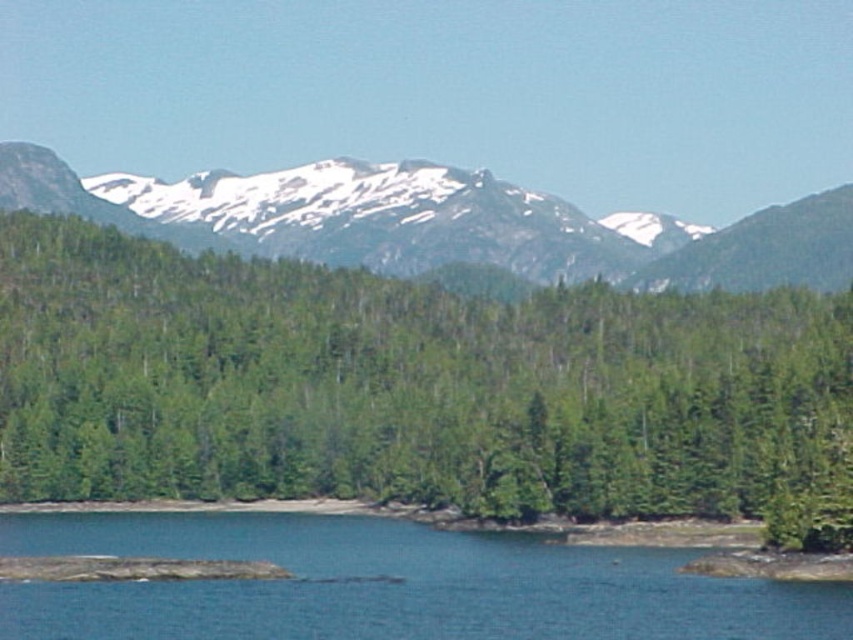
Question: Observing the image, what is the correct spatial positioning of green matte tree at center in reference to blue water at lower center?

Choices:
 (A) above
 (B) below

Answer: (A)

Question: In this image, where is green matte tree at center located relative to blue water at lower center?

Choices:
 (A) left
 (B) right

Answer: (B)

Question: Which of the following is the closest to the observer?

Choices:
 (A) (482, 186)
 (B) (479, 432)

Answer: (B)

Question: In this image, where is blue water at lower center located relative to snowy granite mountain range at upper center?

Choices:
 (A) right
 (B) left

Answer: (B)

Question: Which point is closer to the camera?

Choices:
 (A) (548, 264)
 (B) (242, 624)
 (C) (68, 369)

Answer: (B)

Question: Estimate the real-world distances between objects in this image. Which object is closer to the green matte tree at center?

Choices:
 (A) snowy granite mountain range at upper center
 (B) blue water at lower center

Answer: (B)